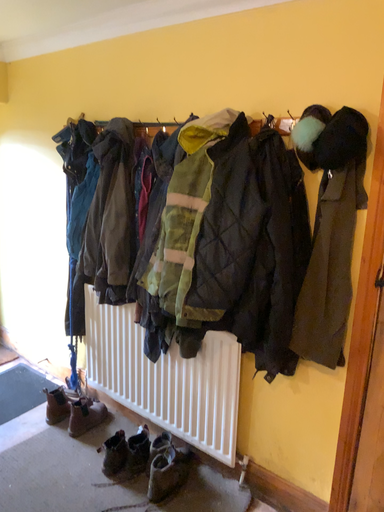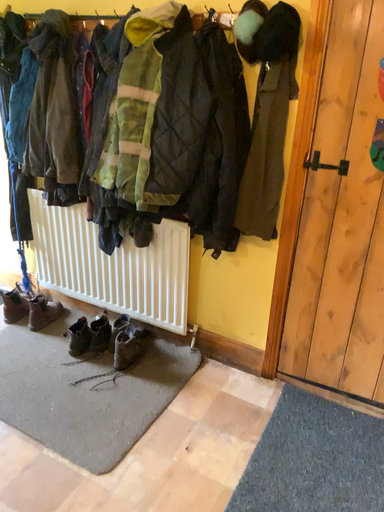
Question: Which way did the camera rotate in the video?

Choices:
 (A) rotated upward
 (B) rotated downward

Answer: (B)